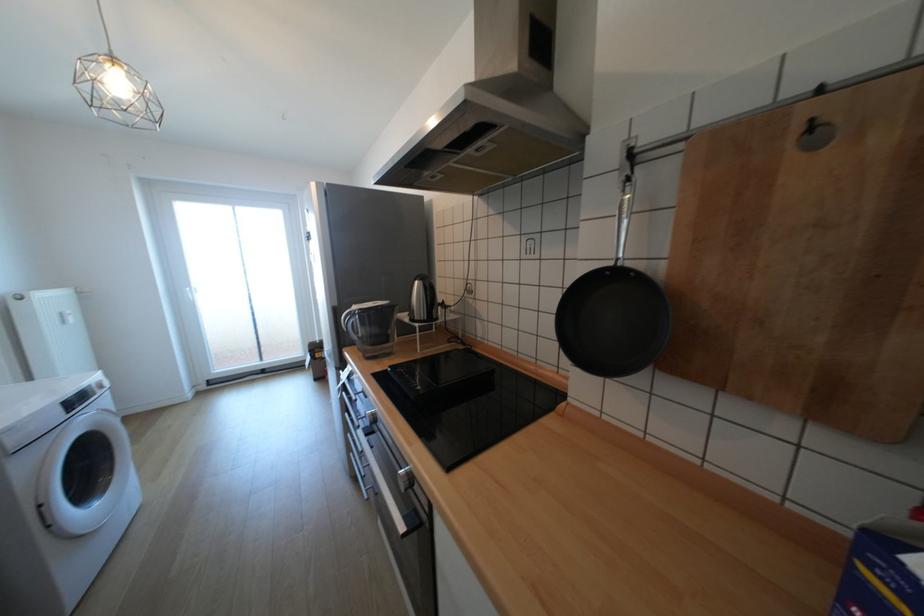
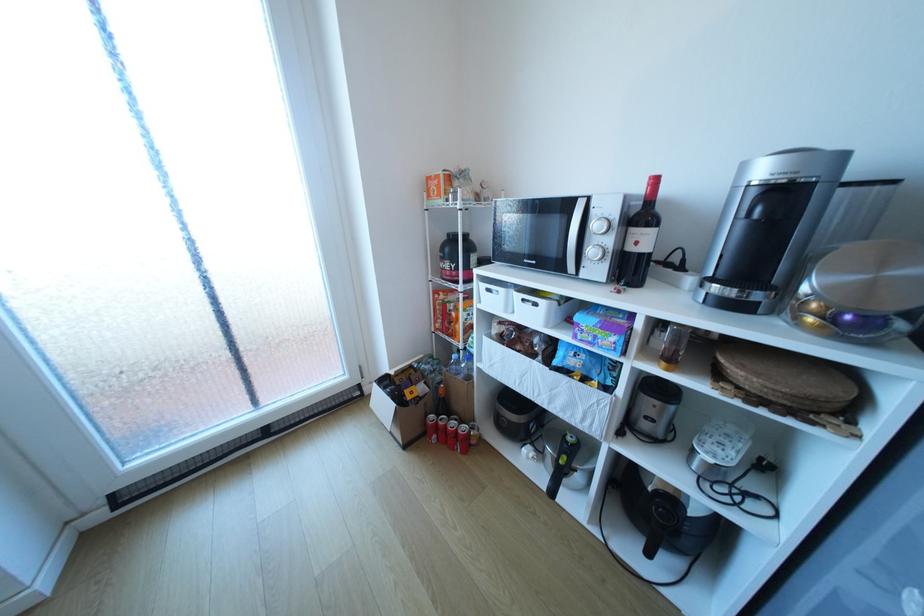
The images are taken continuously from a first-person perspective. In which direction are you moving?

The cameraman moved toward left, forward.